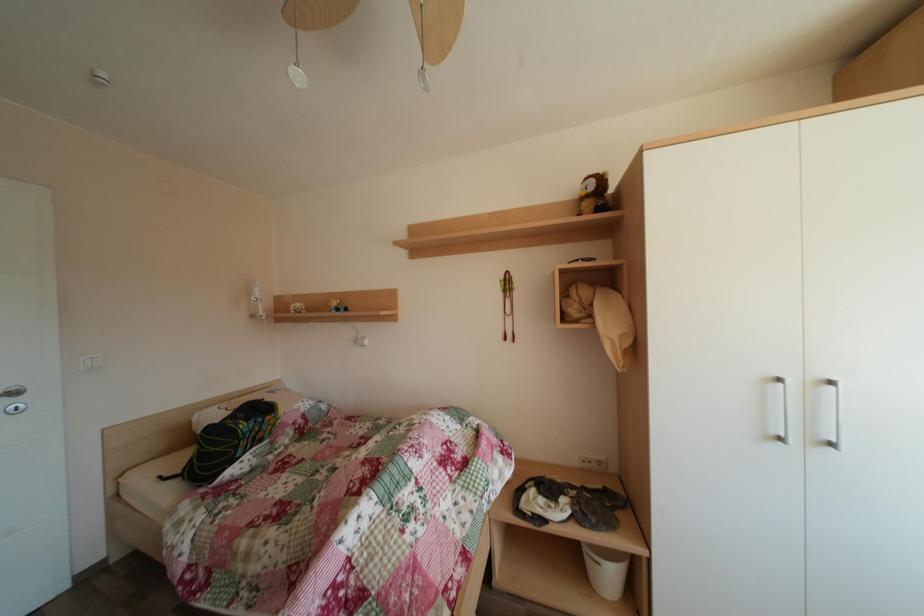
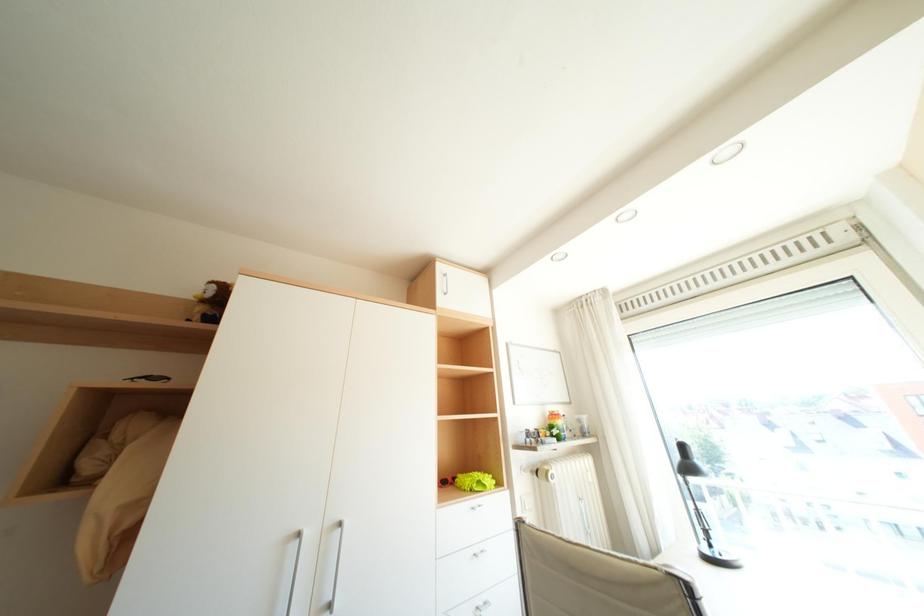
The first image is from the beginning of the video and the second image is from the end. How did the camera likely rotate when shooting the video?

The camera's rotation is toward right-up.